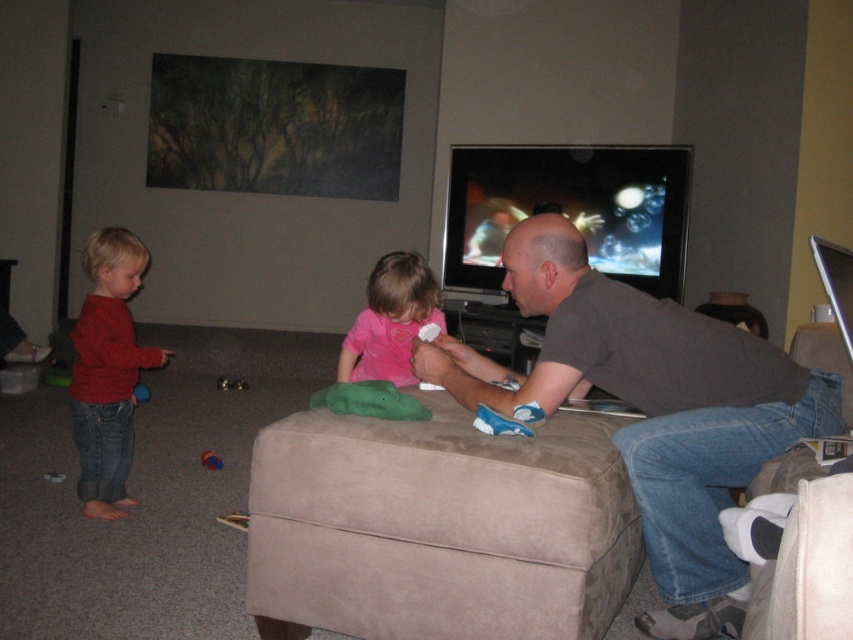
You are a delivery person who needs to place a small package between the matte red sweater at left and the rubberized red ball at lower left. The package is 50 centimeters long. Will it fit in the space between them?

The distance between the matte red sweater at left and the rubberized red ball at lower left is 62.56 centimeters. Since the package is 50 centimeters long, it will fit in the space between them.

You are a guest in the living room and want to sit next to the person wearing the dark gray shirt at center. Which direction should you move relative to the matte red sweater at left?

The dark gray shirt at center is located below the matte red sweater at left, so you should move downward from the matte red sweater at left to sit next to the dark gray shirt at center.

You are a photographer taking a portrait of the dark gray shirt at center and the pink matte shirt at center. Which shirt should you focus on first if you want to capture both in the frame without moving the camera?

The dark gray shirt at center is much taller than the pink matte shirt at center, so you should focus on the dark gray shirt at center first to ensure it is in focus before the shorter one.